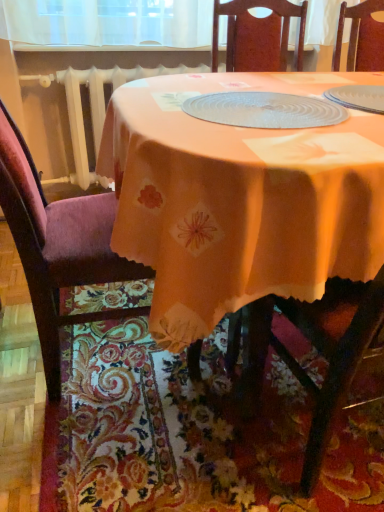
Locate an element on the screen. This screenshot has width=384, height=512. vacant space underneath clear plastic placemat at center (from a real-world perspective) is located at coordinates (261, 112).